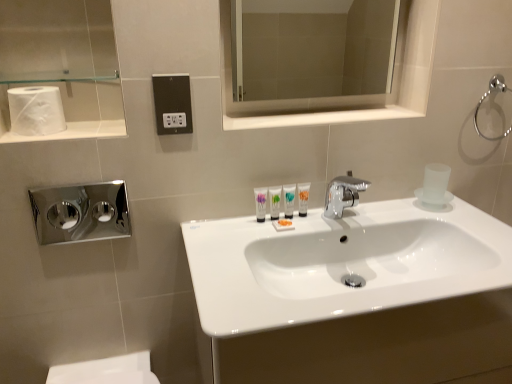
The height and width of the screenshot is (384, 512). What are the coordinates of `chrome/metallic hand dryer at left` in the screenshot? It's located at (81, 213).

The width and height of the screenshot is (512, 384). What are the coordinates of `white glossy tube at center, which is the 2th toiletry from left to right` in the screenshot? It's located at (289, 200).

Describe the element at coordinates (341, 263) in the screenshot. I see `white glossy sink at center` at that location.

The height and width of the screenshot is (384, 512). Identify the location of white glossy tube at center, arranged as the second toiletry when viewed from the right. (275, 201).

In order to click on mouthwash above the white glossy tube at center, arranged as the second toiletry when viewed from the right (from the image's perspective) in this screenshot , I will do `click(303, 198)`.

Between white glossy tube at center, the 1th toiletry viewed from the left, and translucent plastic mouthwash at center, the first mouthwash from the right, which one has larger width?

translucent plastic mouthwash at center, the first mouthwash from the right, is wider.

Can you confirm if white glossy tube at center, the 1th toiletry viewed from the left, is positioned to the left of translucent plastic mouthwash at center, the 2th mouthwash positioned from the left?

Yes.

Could you tell me if white glossy tube at center, arranged as the second toiletry when viewed from the right, is facing translucent plastic mouthwash at center, the 2th mouthwash positioned from the left?

No.

Considering the relative sizes of matte white tube at center, which appears as the first mouthwash when viewed from the left, and translucent plastic mouthwash at center, the 2th mouthwash positioned from the left, in the image provided, is matte white tube at center, which appears as the first mouthwash when viewed from the left, wider than translucent plastic mouthwash at center, the 2th mouthwash positioned from the left,?

In fact, matte white tube at center, which appears as the first mouthwash when viewed from the left, might be narrower than translucent plastic mouthwash at center, the 2th mouthwash positioned from the left.

Would you say matte white tube at center, the second mouthwash in the right-to-left sequence, is a long distance from translucent plastic mouthwash at center, the 2th mouthwash positioned from the left?

Actually, matte white tube at center, the second mouthwash in the right-to-left sequence, and translucent plastic mouthwash at center, the 2th mouthwash positioned from the left, are a little close together.

Consider the image. Is matte white tube at center, the second mouthwash in the right-to-left sequence, inside or outside of translucent plastic mouthwash at center, the 2th mouthwash positioned from the left?

The correct answer is: outside.

Based on the photo, how different are the orientations of matte white tube at center, the second mouthwash in the right-to-left sequence, and translucent plastic mouthwash at center, the first mouthwash from the right, in degrees?

0.00299 degrees separate the facing orientations of matte white tube at center, the second mouthwash in the right-to-left sequence, and translucent plastic mouthwash at center, the first mouthwash from the right.

How many degrees apart are the facing directions of white matte toilet paper at upper left and polished chrome faucet at center?

white matte toilet paper at upper left and polished chrome faucet at center are facing 0.636 degrees away from each other.

This screenshot has width=512, height=384. Identify the location of toilet paper above the polished chrome faucet at center (from a real-world perspective). (36, 110).

Is white matte toilet paper at upper left not inside polished chrome faucet at center?

white matte toilet paper at upper left lies outside polished chrome faucet at center's area.

Is white matte toilet paper at upper left facing away from polished chrome faucet at center?

No, white matte toilet paper at upper left's orientation is not away from polished chrome faucet at center.

Is chrome metallic towel ring at upper right at the left side of white matte toilet paper at upper left?

Incorrect, chrome metallic towel ring at upper right is not on the left side of white matte toilet paper at upper left.

From the image's perspective, between chrome metallic towel ring at upper right and white matte toilet paper at upper left, which one is located above?

From the image's view, chrome metallic towel ring at upper right is above.

Considering the sizes of objects chrome metallic towel ring at upper right and white matte toilet paper at upper left in the image provided, who is smaller, chrome metallic towel ring at upper right or white matte toilet paper at upper left?

Smaller between the two is chrome metallic towel ring at upper right.

Could you tell me if chrome metallic towel ring at upper right is turned towards white matte toilet paper at upper left?

No, chrome metallic towel ring at upper right is not facing towards white matte toilet paper at upper left.

Which is correct: matte white tube at center, which appears as the first mouthwash when viewed from the left, is inside white glossy sink at center, or outside of it?

matte white tube at center, which appears as the first mouthwash when viewed from the left, is outside white glossy sink at center.

Which of these two, matte white tube at center, which appears as the first mouthwash when viewed from the left, or white glossy sink at center, is wider?

white glossy sink at center.

In the scene shown: How many degrees apart are the facing directions of matte white tube at center, the second mouthwash in the right-to-left sequence, and white glossy sink at center?

3.92 degrees separate the facing orientations of matte white tube at center, the second mouthwash in the right-to-left sequence, and white glossy sink at center.

Looking at this image, relative to white glossy sink at center, is matte white tube at center, the second mouthwash in the right-to-left sequence, in front or behind?

Clearly, matte white tube at center, the second mouthwash in the right-to-left sequence, is behind white glossy sink at center.

Which of these two, black plastic outlet at center or polished chrome faucet at center, stands shorter?

black plastic outlet at center.

Is black plastic outlet at center thinner than polished chrome faucet at center?

Indeed, black plastic outlet at center has a lesser width compared to polished chrome faucet at center.

Which object is positioned more to the left, black plastic outlet at center or polished chrome faucet at center?

From the viewer's perspective, black plastic outlet at center appears more on the left side.

From the image's perspective, which one is positioned higher, black plastic outlet at center or polished chrome faucet at center?

black plastic outlet at center, from the image's perspective.

Considering their positions, is polished chrome faucet at center located in front of or behind black plastic outlet at center?

Visually, polished chrome faucet at center is located behind black plastic outlet at center.

From the image's perspective, relative to black plastic outlet at center, is polished chrome faucet at center above or below?

Clearly, from the image's perspective, polished chrome faucet at center is below black plastic outlet at center.

How different are the orientations of polished chrome faucet at center and black plastic outlet at center in degrees?

There is a 1.09-degree angle between the facing directions of polished chrome faucet at center and black plastic outlet at center.

Is polished chrome faucet at center directly adjacent to black plastic outlet at center?

No, polished chrome faucet at center is not beside black plastic outlet at center.

Find the location of `the 2nd mouthwash directly above the white glossy tube at center, the 1th toiletry viewed from the left (from a real-world perspective)`. the 2nd mouthwash directly above the white glossy tube at center, the 1th toiletry viewed from the left (from a real-world perspective) is located at coordinates (303, 198).

Locate an element on the screen. Image resolution: width=512 pixels, height=384 pixels. mouthwash located on the right of matte white tube at center, the second mouthwash in the right-to-left sequence is located at coordinates (303, 198).

Estimate the real-world distances between objects in this image. Which object is closer to black plastic outlet at center, chrome/metallic hand dryer at left or white glossy sink at center?

white glossy sink at center is closer to black plastic outlet at center.

Which object lies nearer to the anchor point chrome metallic towel ring at upper right, white glossy medicine cabinet at upper center or matte white tube at center, the second mouthwash in the right-to-left sequence?

white glossy medicine cabinet at upper center lies closer to chrome metallic towel ring at upper right than the other object.

Estimate the real-world distances between objects in this image. Which object is further from white glossy tube at center, which is the 2th toiletry from left to right, white matte toilet paper at upper left or white glossy medicine cabinet at upper center?

Among the two, white matte toilet paper at upper left is located further to white glossy tube at center, which is the 2th toiletry from left to right.

Looking at the image, which one is located closer to polished chrome faucet at center, black plastic outlet at center or white glossy tube at center, which ranks as the first toiletry in right-to-left order?

white glossy tube at center, which ranks as the first toiletry in right-to-left order, is closer to polished chrome faucet at center.

When comparing their distances from black plastic outlet at center, does white glossy medicine cabinet at upper center or chrome metallic towel ring at upper right seem closer?

Based on the image, white glossy medicine cabinet at upper center appears to be nearer to black plastic outlet at center.

Which object lies further to the anchor point black plastic outlet at center, white glossy tube at center, arranged as the second toiletry when viewed from the right, or chrome metallic towel ring at upper right?

chrome metallic towel ring at upper right is positioned further to the anchor black plastic outlet at center.

Based on their spatial positions, is white glossy tube at center, which is the 2th toiletry from left to right, or white glossy sink at center further from translucent plastic mouthwash at center, the first mouthwash from the right?

The object further to translucent plastic mouthwash at center, the first mouthwash from the right, is white glossy sink at center.

When comparing their distances from translucent plastic mouthwash at center, the 2th mouthwash positioned from the left, does white matte toilet paper at upper left or chrome metallic towel ring at upper right seem closer?

Based on the image, chrome metallic towel ring at upper right appears to be nearer to translucent plastic mouthwash at center, the 2th mouthwash positioned from the left.

Where is `mouthwash situated between black plastic outlet at center and white glossy tube at center, which ranks as the first toiletry in right-to-left order, from left to right`? This screenshot has width=512, height=384. mouthwash situated between black plastic outlet at center and white glossy tube at center, which ranks as the first toiletry in right-to-left order, from left to right is located at coordinates (x=260, y=203).

Find the location of a particular element. Image resolution: width=512 pixels, height=384 pixels. hand dryer between white matte toilet paper at upper left and white glossy medicine cabinet at upper center from left to right is located at coordinates (81, 213).

Find the location of a particular element. mouthwash between white glossy medicine cabinet at upper center and matte white tube at center, which appears as the first mouthwash when viewed from the left, vertically is located at coordinates (303, 198).

Locate an element on the screen. This screenshot has height=384, width=512. electric outlet between white matte toilet paper at upper left and white glossy tube at center, which is the 2th toiletry from left to right, from left to right is located at coordinates (172, 104).